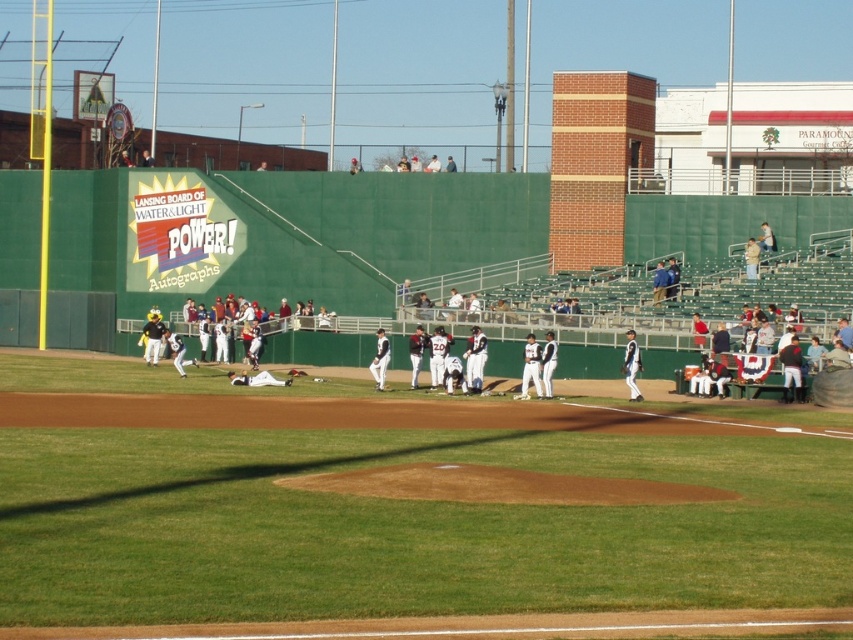
Question: Can you confirm if green grass field at center is wider than white uniformed player at center?

Choices:
 (A) yes
 (B) no

Answer: (A)

Question: Is green grass field at center bigger than white uniformed player at center?

Choices:
 (A) no
 (B) yes

Answer: (B)

Question: Is green grass field at center behind white uniformed player at center?

Choices:
 (A) yes
 (B) no

Answer: (B)

Question: Among these objects, which one is farthest from the camera?

Choices:
 (A) green grass field at center
 (B) white uniformed player at center

Answer: (B)